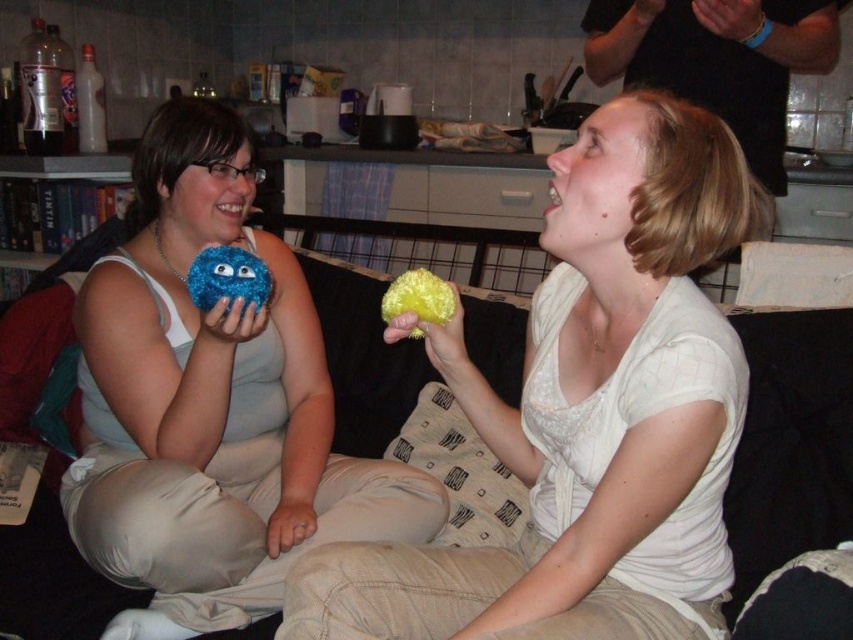
From the picture: You are a delivery robot that needs to place a package between the yellow fuzzy ball at upper right and the matte blue plush toy at center. The package requires a minimum of 50 centimeters of space. Can you fit the package between them?

The yellow fuzzy ball at upper right is 49.45 centimeters from matte blue plush toy at center. Since the required space is 50 centimeters, the package cannot be placed between them as there is insufficient space.

You are trying to place a new decorative item on the countertop behind the two people. You have a small vase that needs to be placed between the matte blue plush toy at center and the fuzzy blue ball at left. Can you fit the vase between them?

The matte blue plush toy at center is positioned under the fuzzy blue ball at left, so the vertical space between them may be sufficient for placing the vase. However, since the description only mentions their vertical positioning, the horizontal distance isn not specified. You should check the horizontal space before placing the vase.